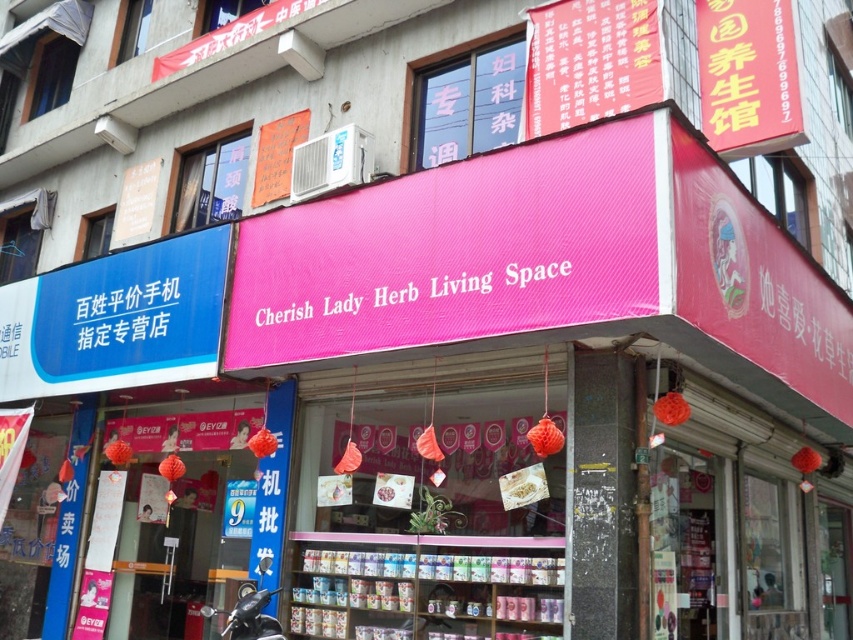
Which is more to the right, black matte motorcycle at lower left or whitetext on fabric cherish lady herb living space at center?

whitetext on fabric cherish lady herb living space at center

Can you confirm if black matte motorcycle at lower left is shorter than whitetext on fabric cherish lady herb living space at center?

Incorrect, black matte motorcycle at lower left's height does not fall short of whitetext on fabric cherish lady herb living space at center's.

Is point (256, 596) behind point (405, 292)?

Yes.

I want to click on black matte motorcycle at lower left, so click(x=248, y=614).